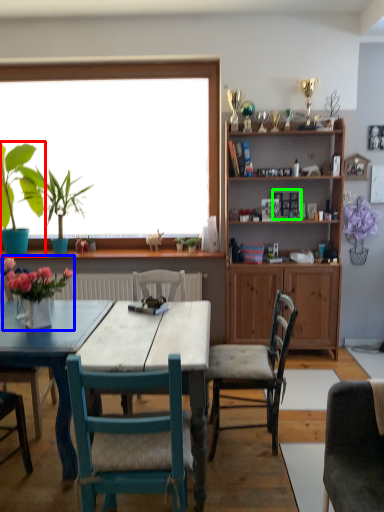
Question: Estimate the real-world distances between objects in this image. Which object is farther from houseplant (highlighted by a red box), floral arrangement (highlighted by a blue box) or picture frame (highlighted by a green box)?

Choices:
 (A) floral arrangement
 (B) picture frame

Answer: (B)